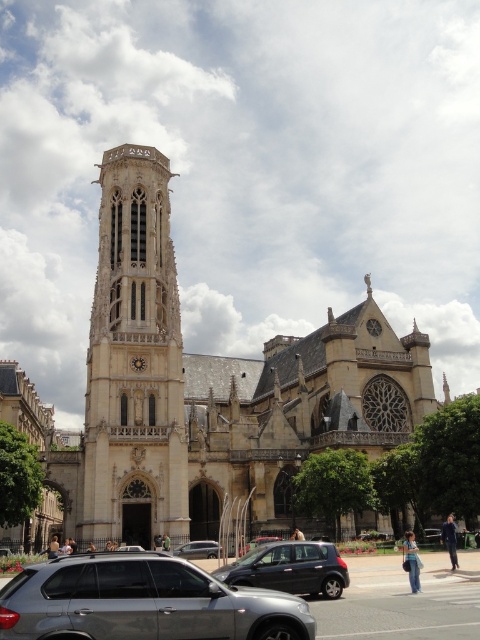
Which is more to the right, golden stone church at center or silver metallic suv at lower center?

silver metallic suv at lower center

Who is higher up, golden stone church at center or silver metallic suv at lower center?

golden stone church at center is higher up.

Is point (196, 384) more distant than point (33, 609)?

Yes, it is.

Identify the location of golden stone church at center. (204, 392).

Is stone tower at center below silver metallic suv at lower center?

Actually, stone tower at center is above silver metallic suv at lower center.

Can you confirm if stone tower at center is smaller than silver metallic suv at lower center?

Incorrect, stone tower at center is not smaller in size than silver metallic suv at lower center.

What do you see at coordinates (130, 360) in the screenshot?
I see `stone tower at center` at bounding box center [130, 360].

This screenshot has width=480, height=640. Identify the location of stone tower at center. (130, 360).

Does golden stone church at center have a smaller size compared to stone tower at center?

No.

Between point (126, 291) and point (136, 260), which one is positioned behind?

The point (136, 260) is behind.

Locate an element on the screen. golden stone church at center is located at coordinates (204, 392).

Find the location of a particular element. The height and width of the screenshot is (640, 480). golden stone church at center is located at coordinates [x=204, y=392].